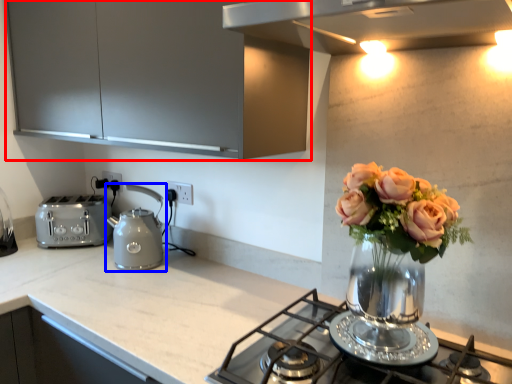
Question: Which point is further to the camera, cabinetry (highlighted by a red box) or kettle (highlighted by a blue box)?

Choices:
 (A) cabinetry
 (B) kettle

Answer: (B)